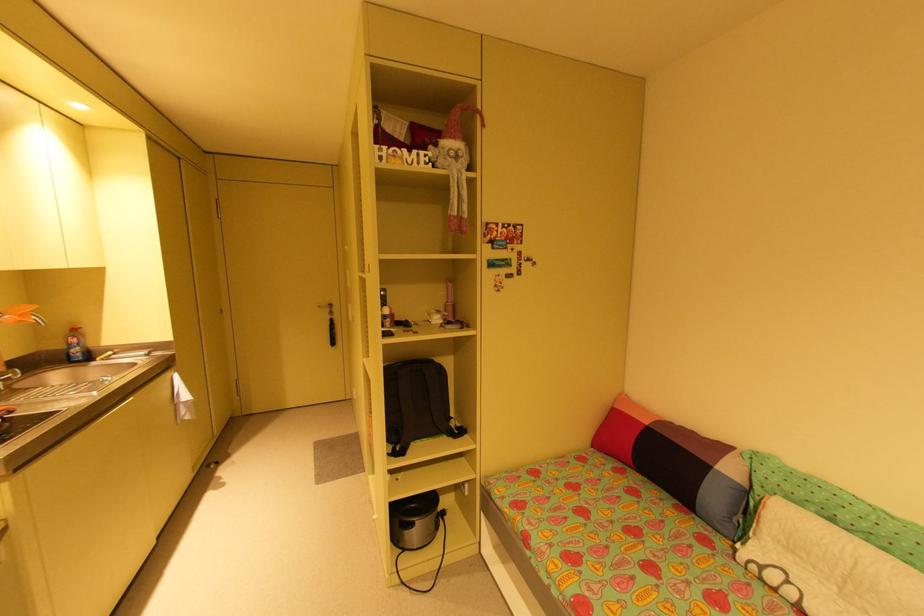
At what (x,y) coordinates should I click in order to perform the action: click on red soap dispenser. Please return your answer as a coordinate pair (x, y). The image size is (924, 616). Looking at the image, I should click on (76, 346).